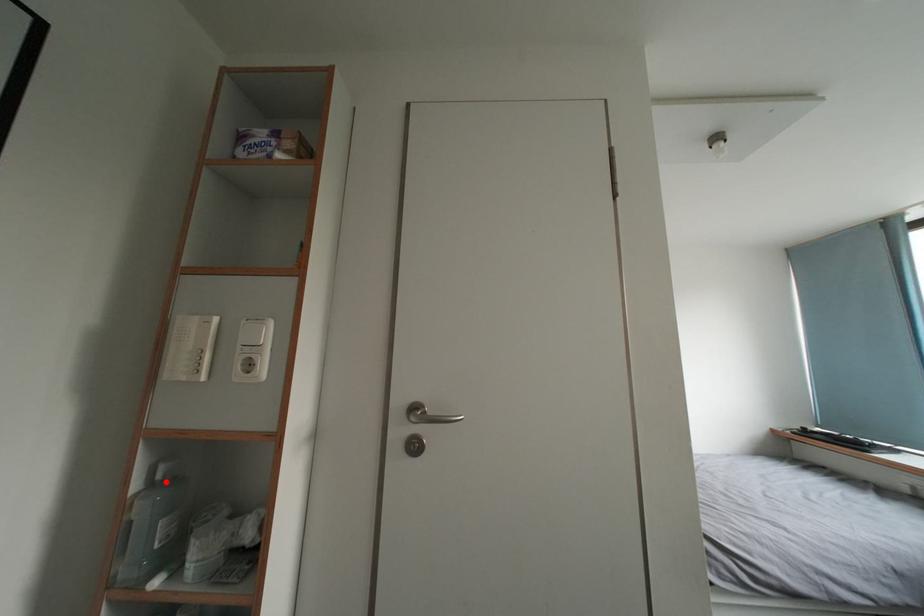
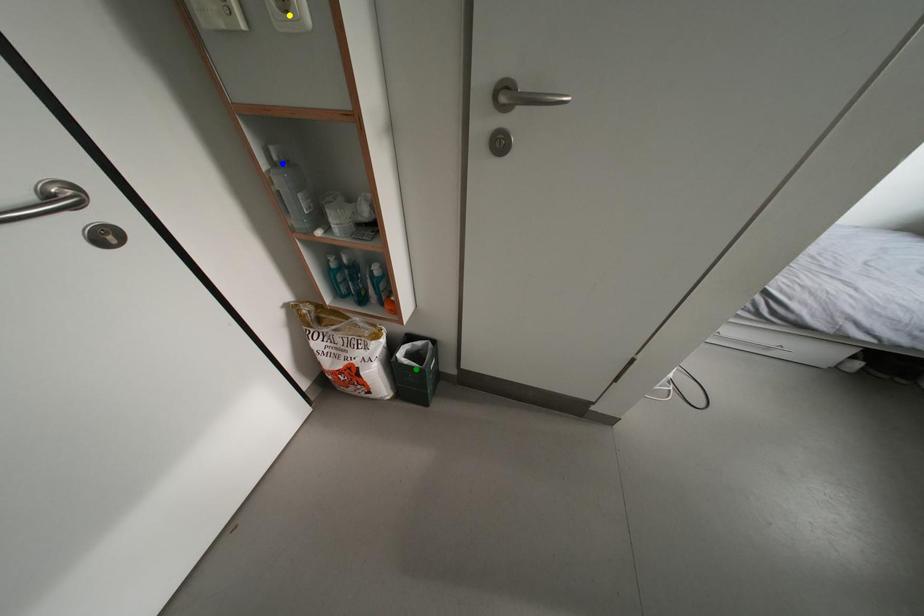
Question: I am providing you with two images of the same scene from different viewpoints. A red point is marked on the first image. You are given multiple points on the second image. Which mark in image 2 goes with the point in image 1?

Choices:
 (A) green point
 (B) yellow point
 (C) blue point

Answer: (C)